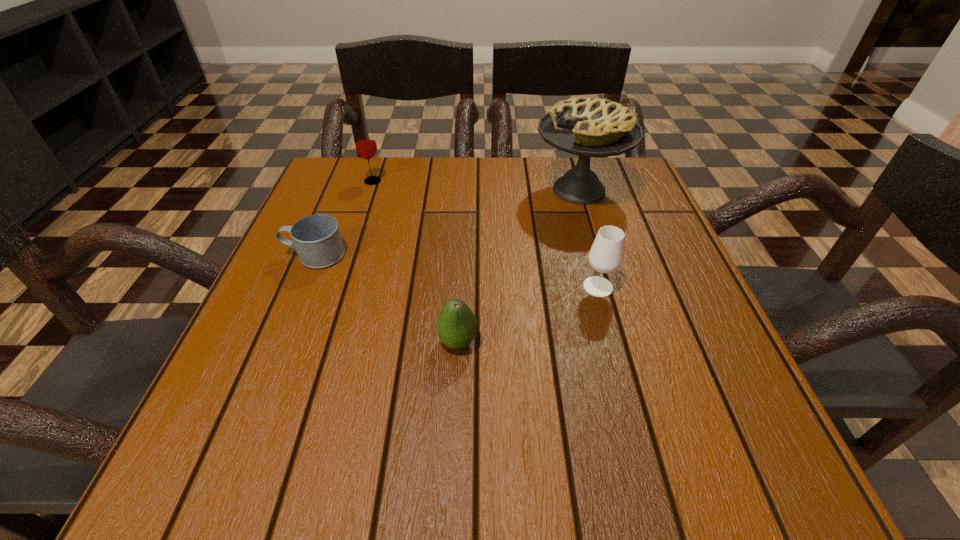
The image size is (960, 540). In order to click on object at the far left corner in this screenshot , I will do `click(365, 143)`.

Locate an element on the screen. The image size is (960, 540). object that is positioned at the far right corner is located at coordinates (584, 126).

I want to click on free space at the far edge of the desktop, so click(x=564, y=168).

Locate an element on the screen. The height and width of the screenshot is (540, 960). vacant area at the left edge is located at coordinates (276, 381).

Find the location of a particular element. The width and height of the screenshot is (960, 540). free space at the right edge is located at coordinates (664, 240).

Identify the location of vacant area at the far left corner. (374, 174).

In the image, there is a desktop. At what (x,y) coordinates should I click in order to perform the action: click on vacant space at the near left corner. Please return your answer as a coordinate pair (x, y). Looking at the image, I should click on (188, 447).

This screenshot has width=960, height=540. What are the coordinates of `free location at the far right corner` in the screenshot? It's located at (616, 189).

This screenshot has height=540, width=960. Identify the location of free spot between the second shortest object and the mug. point(387,299).

Where is `free space that is in between the third nearest object and the pie`? The height and width of the screenshot is (540, 960). free space that is in between the third nearest object and the pie is located at coordinates (447, 222).